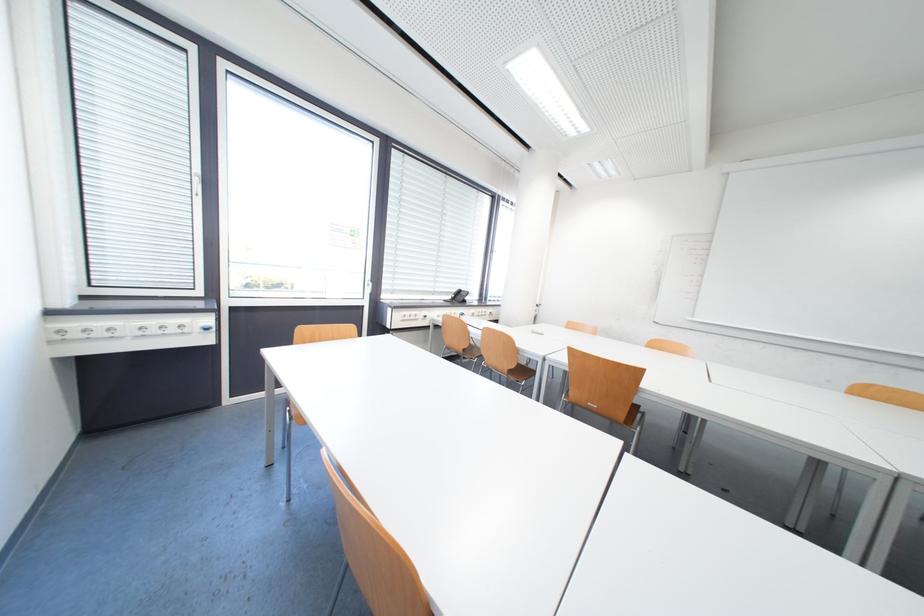
Find the location of a particular element. blind crank handle is located at coordinates (200, 185).